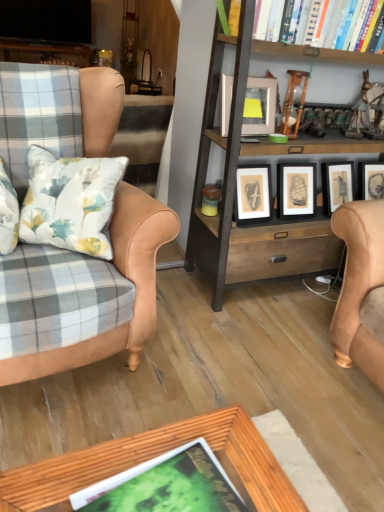
Question: Considering the relative positions of leather armchair at left and matte silver picture frame at upper center in the image provided, is leather armchair at left to the left of matte silver picture frame at upper center from the viewer's perspective?

Choices:
 (A) no
 (B) yes

Answer: (B)

Question: Considering the relative sizes of leather armchair at left and matte silver picture frame at upper center in the image provided, is leather armchair at left thinner than matte silver picture frame at upper center?

Choices:
 (A) yes
 (B) no

Answer: (B)

Question: Is leather armchair at left closer to the viewer compared to matte silver picture frame at upper center?

Choices:
 (A) no
 (B) yes

Answer: (B)

Question: Could you tell me if leather armchair at left is turned towards matte silver picture frame at upper center?

Choices:
 (A) yes
 (B) no

Answer: (B)

Question: Is leather armchair at left smaller than matte silver picture frame at upper center?

Choices:
 (A) yes
 (B) no

Answer: (B)

Question: From a real-world perspective, is wooden bookcase at center above or below leather armchair at left?

Choices:
 (A) above
 (B) below

Answer: (A)

Question: Does point (231, 212) appear closer or farther from the camera than point (150, 232)?

Choices:
 (A) closer
 (B) farther

Answer: (B)

Question: Is wooden bookcase at center wider or thinner than leather armchair at left?

Choices:
 (A) thin
 (B) wide

Answer: (A)

Question: Choose the correct answer: Is wooden bookcase at center inside leather armchair at left or outside it?

Choices:
 (A) inside
 (B) outside

Answer: (B)

Question: Is point (249, 115) positioned closer to the camera than point (72, 501)?

Choices:
 (A) closer
 (B) farther

Answer: (B)

Question: Is matte silver picture frame at upper center taller or shorter than green matte book at lower center, placed as the 1th book when sorted from left to right?

Choices:
 (A) tall
 (B) short

Answer: (A)

Question: From a real-world perspective, is matte silver picture frame at upper center positioned above or below green matte book at lower center, placed as the 2th book when sorted from right to left?

Choices:
 (A) above
 (B) below

Answer: (A)

Question: In terms of width, does matte silver picture frame at upper center look wider or thinner when compared to green matte book at lower center, marked as the 1th book in a front-to-back arrangement?

Choices:
 (A) thin
 (B) wide

Answer: (A)

Question: Does point (306, 48) appear closer or farther from the camera than point (200, 266)?

Choices:
 (A) closer
 (B) farther

Answer: (A)

Question: From the image's perspective, is hardcover book at upper right, placed as the second book when sorted from bottom to top, located above or below wooden bookcase at center?

Choices:
 (A) above
 (B) below

Answer: (A)